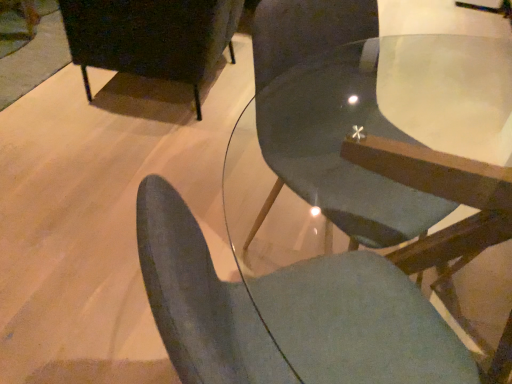
Question: Is matte gray chair at center, which appears as the 3th chair when viewed from the back, situated inside matte gray chair at center, which is the second chair from back to front, or outside?

Choices:
 (A) outside
 (B) inside

Answer: (A)

Question: Looking at their shapes, would you say matte gray chair at center, the first chair when ordered from front to back, is wider or thinner than matte gray chair at center, which is the second chair from back to front?

Choices:
 (A) wide
 (B) thin

Answer: (B)

Question: Estimate the real-world distances between objects in this image. Which object is closer to the matte gray chair at center, the first chair when ordered from front to back?

Choices:
 (A) matte black chair at upper left, positioned as the first chair in back-to-front order
 (B) matte gray chair at center, acting as the 2th chair starting from the front

Answer: (B)

Question: Which object is the farthest from the matte gray chair at center, acting as the 2th chair starting from the front?

Choices:
 (A) matte black chair at upper left, positioned as the first chair in back-to-front order
 (B) matte gray chair at center, which appears as the 3th chair when viewed from the back

Answer: (A)